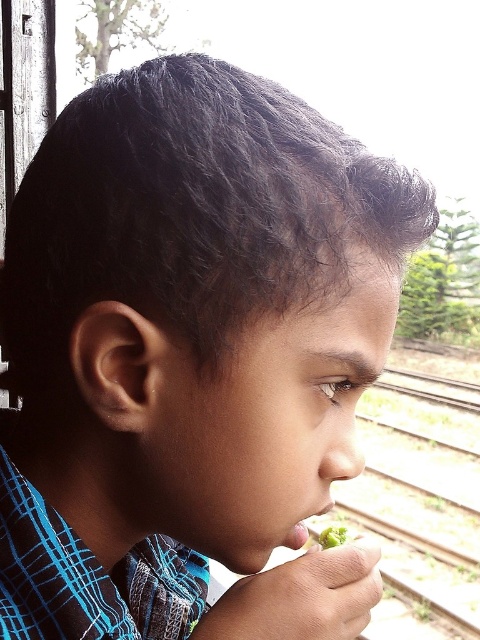
Is metal train track at right bigger than green matte food at mouth?

Yes, metal train track at right is bigger than green matte food at mouth.

Does metal train track at right have a lesser height compared to green matte food at mouth?

No.

Identify the location of metal train track at right. The height and width of the screenshot is (640, 480). (420, 502).

Identify the location of metal train track at right. (420, 502).